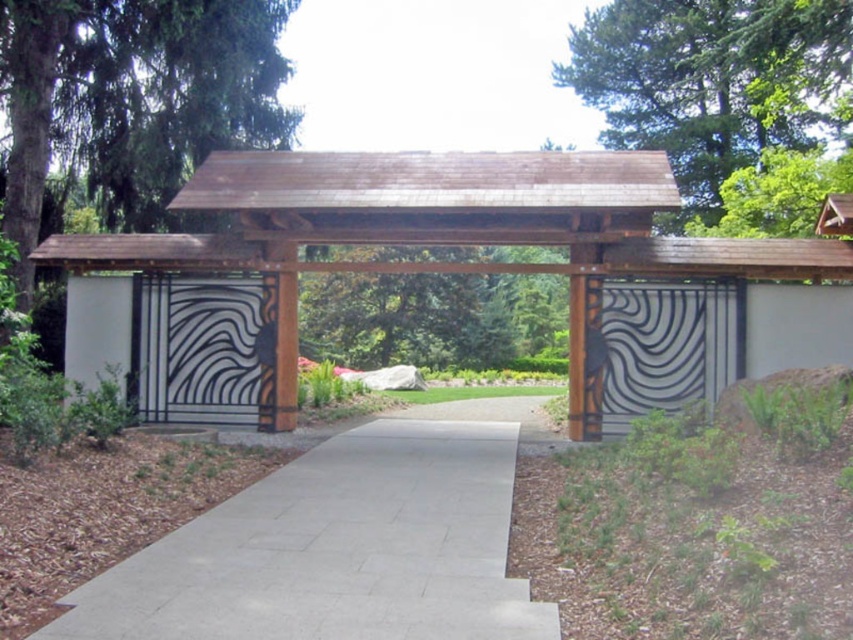
You are standing in front of the architectural structure described. You want to walk from the gray concrete pavement at center to the black metal gate at center. Which direction should you move?

The gray concrete pavement at center is in front of the black metal gate at center, so you should move backward to reach the black metal gate at center from the gray concrete pavement at center.